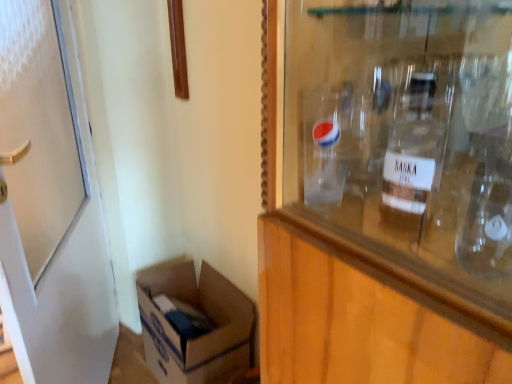
Question: Is white cardboard box at lower left inside or outside of white matte door at left?

Choices:
 (A) outside
 (B) inside

Answer: (A)

Question: Considering the positions of point (237, 289) and point (26, 61), is point (237, 289) closer or farther from the camera than point (26, 61)?

Choices:
 (A) closer
 (B) farther

Answer: (B)

Question: Estimate the real-world distances between objects in this image. Which object is farther from the white matte door at left?

Choices:
 (A) clear glass bottle at upper right
 (B) white cardboard box at lower left

Answer: (A)

Question: Based on their relative distances, which object is nearer to the clear glass bottle at upper right?

Choices:
 (A) white matte door at left
 (B) white cardboard box at lower left

Answer: (A)